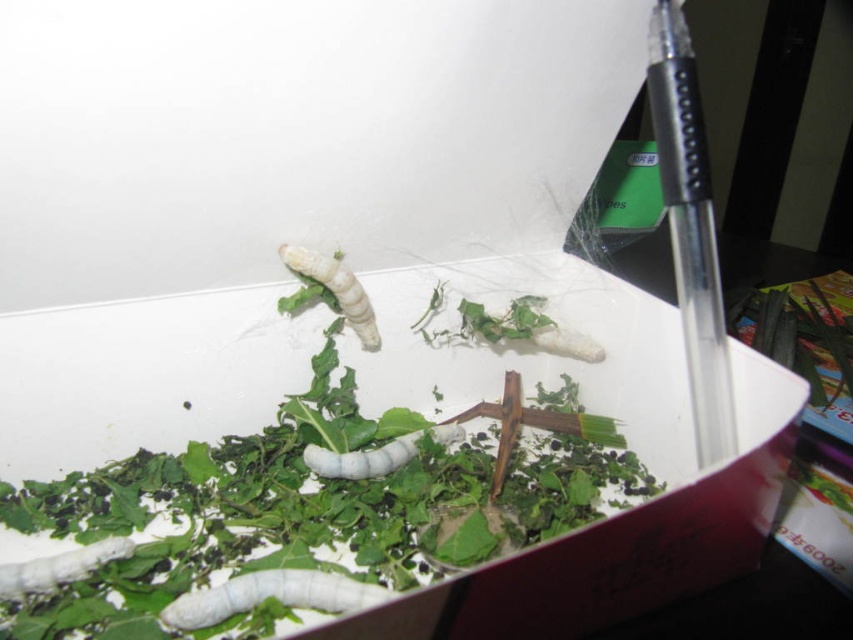
Does green leafy plant at center appear under white matte caterpillar at lower center?

Actually, green leafy plant at center is above white matte caterpillar at lower center.

Does point (341, 618) come behind point (178, 616)?

That is False.

Image resolution: width=853 pixels, height=640 pixels. I want to click on green leafy plant at center, so click(285, 452).

From the picture: Can you confirm if white matte caterpillar at lower center is smaller than white matte worm at center?

Yes, white matte caterpillar at lower center is smaller than white matte worm at center.

Which is more to the left, white matte caterpillar at lower center or white matte worm at center?

white matte caterpillar at lower center is more to the left.

Identify the location of white matte caterpillar at lower center. (271, 596).

Image resolution: width=853 pixels, height=640 pixels. I want to click on green leafy plant at right, so click(x=801, y=333).

Who is positioned more to the left, green leafy plant at right or white matte worm at center?

white matte worm at center is more to the left.

The image size is (853, 640). What are the coordinates of `green leafy plant at right` in the screenshot? It's located at [x=801, y=333].